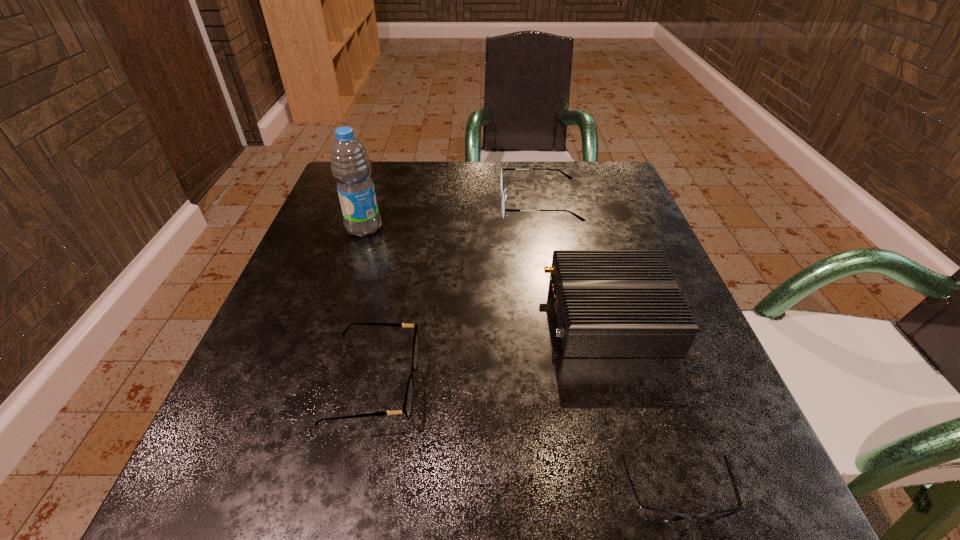
The width and height of the screenshot is (960, 540). What are the coordinates of `free spot located 0.260m on the lenses of the tallest spectacles` in the screenshot? It's located at (385, 204).

You are a GUI agent. You are given a task and a screenshot of the screen. Output one action in this format:
    pyautogui.click(x=<x>, y=<y>)
    Task: Click on the free space located 0.210m on the lenses of the tallest spectacles
    The height and width of the screenshot is (540, 960).
    Given the screenshot: What is the action you would take?
    pyautogui.click(x=407, y=204)

In order to click on vacant position located 0.170m on the lenses of the tallest spectacles in this screenshot , I will do `click(425, 204)`.

Where is `vacant region located 0.300m on the front-facing side of the second nearest spectacles`? The width and height of the screenshot is (960, 540). vacant region located 0.300m on the front-facing side of the second nearest spectacles is located at coordinates (622, 383).

Where is `object present at the far edge`? This screenshot has width=960, height=540. object present at the far edge is located at coordinates (504, 196).

Identify the location of object that is at the near edge. (658, 515).

Find the location of `water bottle present at the left edge`. water bottle present at the left edge is located at coordinates (350, 164).

You are a GUI agent. You are given a task and a screenshot of the screen. Output one action in this format:
    pyautogui.click(x=<x>, y=<y>)
    Task: Click on the spectacles situated at the left edge
    Image resolution: width=960 pixels, height=540 pixels.
    Given the screenshot: What is the action you would take?
    coord(408,402)

Locate an element on the screen. This screenshot has width=960, height=540. router at the right edge is located at coordinates (609, 303).

Where is `object located at the far right corner`? Image resolution: width=960 pixels, height=540 pixels. object located at the far right corner is located at coordinates (504, 196).